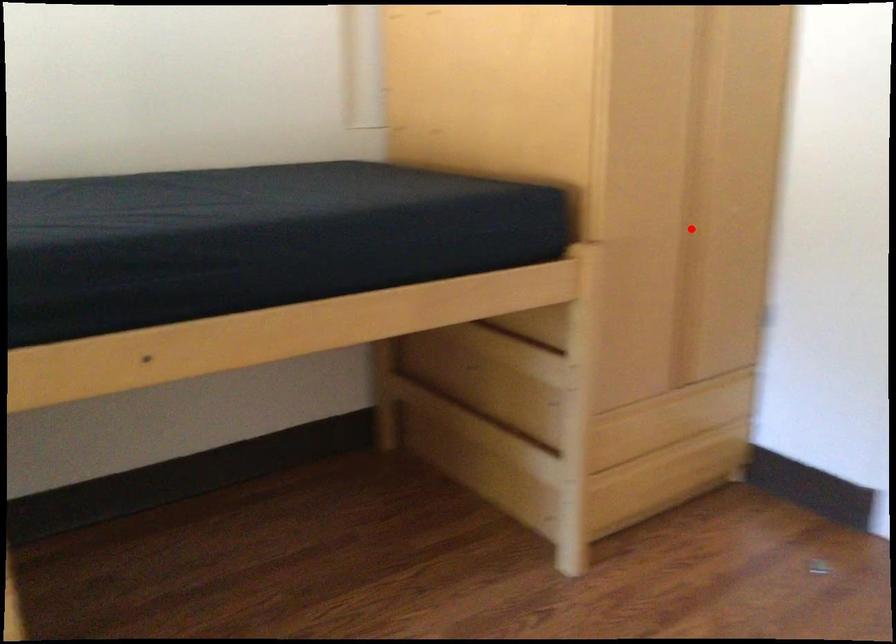
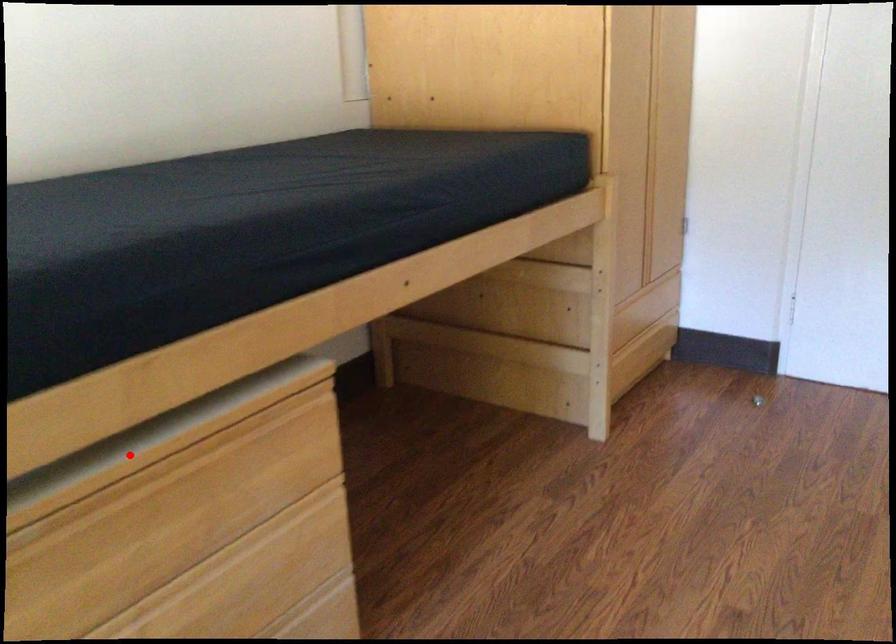
I am providing you with two images of the same scene from different viewpoints. A red point is marked on the first image and another point is marked on the second image. Do the highlighted points in image1 and image2 indicate the same real-world spot?

No